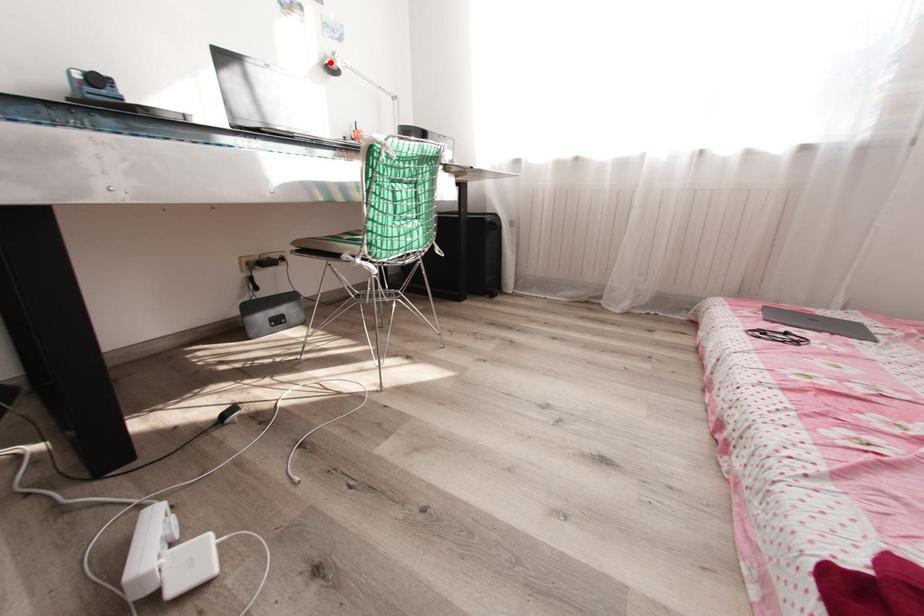
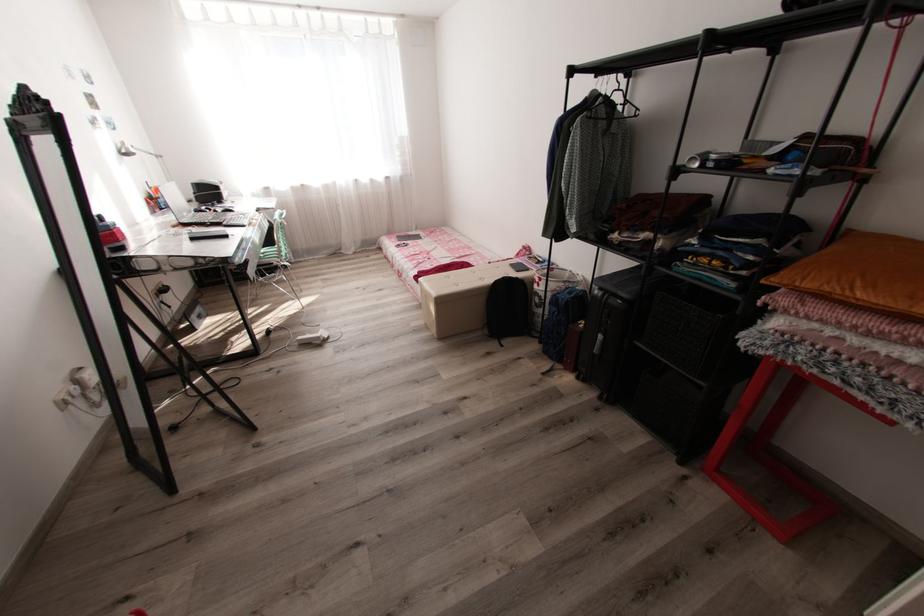
Question: I am providing you with two images of the same scene from different viewpoints. Given a red point in image1, look at the same physical point in image2. Is it:

Choices:
 (A) Closer to the viewpoint
 (B) Farther from the viewpoint

Answer: (B)